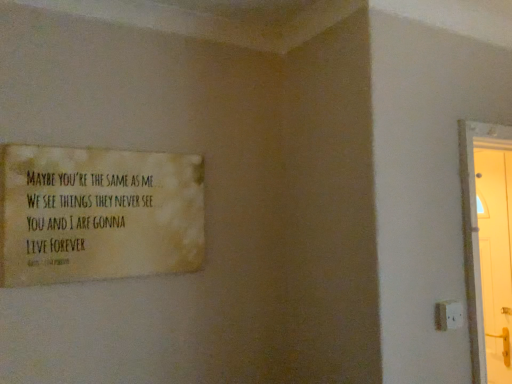
Question: Considering the relative sizes of matte yellow poster at upper left and white plastic electric outlet at lower right in the image provided, is matte yellow poster at upper left shorter than white plastic electric outlet at lower right?

Choices:
 (A) yes
 (B) no

Answer: (B)

Question: Does matte yellow poster at upper left have a greater height compared to white plastic electric outlet at lower right?

Choices:
 (A) yes
 (B) no

Answer: (A)

Question: Does matte yellow poster at upper left have a lesser width compared to white plastic electric outlet at lower right?

Choices:
 (A) no
 (B) yes

Answer: (A)

Question: From the image's perspective, is matte yellow poster at upper left located above white plastic electric outlet at lower right?

Choices:
 (A) no
 (B) yes

Answer: (B)

Question: Is matte yellow poster at upper left to the right of white plastic electric outlet at lower right from the viewer's perspective?

Choices:
 (A) no
 (B) yes

Answer: (A)

Question: From a real-world perspective, is matte yellow poster at upper left located higher than white plastic electric outlet at lower right?

Choices:
 (A) no
 (B) yes

Answer: (B)

Question: Considering the relative sizes of white plastic electric outlet at lower right and matte yellow poster at upper left in the image provided, is white plastic electric outlet at lower right shorter than matte yellow poster at upper left?

Choices:
 (A) no
 (B) yes

Answer: (B)

Question: Does white plastic electric outlet at lower right come behind matte yellow poster at upper left?

Choices:
 (A) no
 (B) yes

Answer: (B)

Question: From a real-world perspective, does white plastic electric outlet at lower right sit lower than matte yellow poster at upper left?

Choices:
 (A) yes
 (B) no

Answer: (A)

Question: Considering the relative positions of white plastic electric outlet at lower right and matte yellow poster at upper left in the image provided, is white plastic electric outlet at lower right in front of matte yellow poster at upper left?

Choices:
 (A) yes
 (B) no

Answer: (B)

Question: Are white plastic electric outlet at lower right and matte yellow poster at upper left far apart?

Choices:
 (A) no
 (B) yes

Answer: (B)

Question: From the image's perspective, does white plastic electric outlet at lower right appear lower than matte yellow poster at upper left?

Choices:
 (A) yes
 (B) no

Answer: (A)

Question: In the image, is white plastic electric outlet at lower right positioned in front of or behind matte yellow poster at upper left?

Choices:
 (A) behind
 (B) front

Answer: (A)